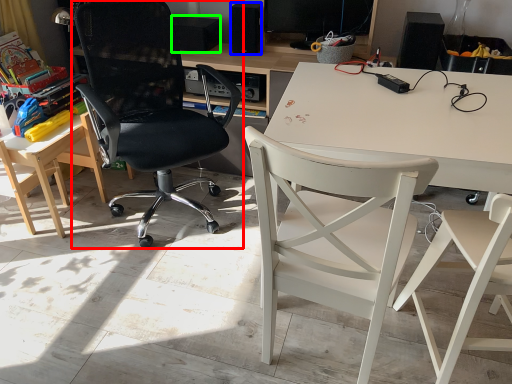
Question: Which is nearer to the chair (highlighted by a red box)? loudspeaker (highlighted by a blue box) or loudspeaker (highlighted by a green box).

Choices:
 (A) loudspeaker
 (B) loudspeaker

Answer: (B)